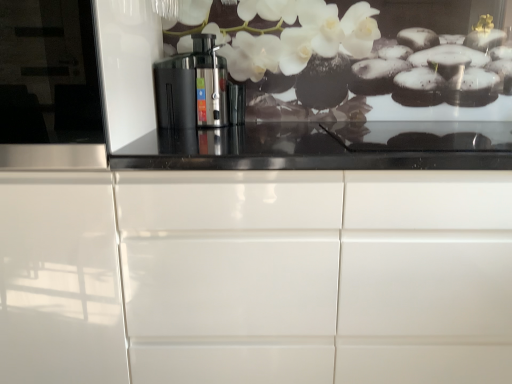
Question: Are white glossy cabinet at center and transparent glossy glass door at left beside each other?

Choices:
 (A) no
 (B) yes

Answer: (A)

Question: From a real-world perspective, is white glossy cabinet at center below transparent glossy glass door at left?

Choices:
 (A) no
 (B) yes

Answer: (B)

Question: From the image's perspective, is white glossy cabinet at center above transparent glossy glass door at left?

Choices:
 (A) yes
 (B) no

Answer: (B)

Question: Is white glossy cabinet at center behind transparent glossy glass door at left?

Choices:
 (A) no
 (B) yes

Answer: (B)

Question: Is white glossy cabinet at center aimed at transparent glossy glass door at left?

Choices:
 (A) no
 (B) yes

Answer: (A)

Question: Does white glossy cabinet at center have a lesser height compared to transparent glossy glass door at left?

Choices:
 (A) yes
 (B) no

Answer: (B)

Question: From the image's perspective, does black plastic juicer at center appear higher than white glossy cabinet at center?

Choices:
 (A) yes
 (B) no

Answer: (A)

Question: Does black plastic juicer at center have a lesser height compared to white glossy cabinet at center?

Choices:
 (A) no
 (B) yes

Answer: (B)

Question: Would you consider black plastic juicer at center to be distant from white glossy cabinet at center?

Choices:
 (A) no
 (B) yes

Answer: (A)

Question: Considering the relative sizes of black plastic juicer at center and white glossy cabinet at center in the image provided, is black plastic juicer at center smaller than white glossy cabinet at center?

Choices:
 (A) no
 (B) yes

Answer: (B)

Question: Does black plastic juicer at center have a greater width compared to white glossy cabinet at center?

Choices:
 (A) yes
 (B) no

Answer: (B)

Question: Considering the relative sizes of black plastic juicer at center and white glossy cabinet at center in the image provided, is black plastic juicer at center bigger than white glossy cabinet at center?

Choices:
 (A) no
 (B) yes

Answer: (A)

Question: Does white glossy cabinet at center lie behind black plastic juicer at center?

Choices:
 (A) yes
 (B) no

Answer: (B)